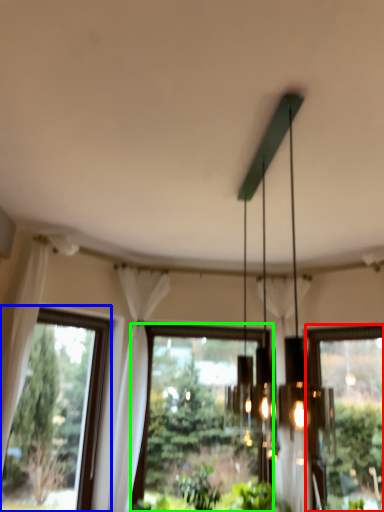
Question: Based on their relative distances, which object is nearer to window (highlighted by a red box)? Choose from window (highlighted by a blue box) and window (highlighted by a green box).

Choices:
 (A) window
 (B) window

Answer: (B)